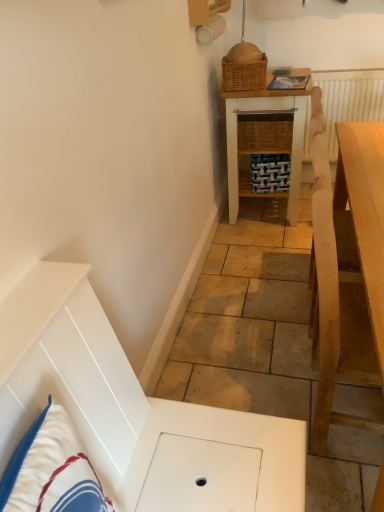
Locate an element on the screen. The height and width of the screenshot is (512, 384). white textured radiator at upper right is located at coordinates (349, 99).

At what (x,y) coordinates should I click in order to perform the action: click on light wood table at right, placed as the first table when sorted from front to back. Please return your answer as a coordinate pair (x, y). The height and width of the screenshot is (512, 384). Looking at the image, I should click on (337, 301).

Measure the distance between point (382, 156) and camera.

The distance of point (382, 156) from camera is 5.43 feet.

Where is `white cotton pillow at lower left`? This screenshot has height=512, width=384. white cotton pillow at lower left is located at coordinates (52, 470).

Is white textured radiator at upper right behind woven brown picnic basket at upper center?

Yes, white textured radiator at upper right is behind woven brown picnic basket at upper center.

Which is correct: white textured radiator at upper right is inside woven brown picnic basket at upper center, or outside of it?

white textured radiator at upper right is not enclosed by woven brown picnic basket at upper center.

Can you confirm if white textured radiator at upper right is smaller than woven brown picnic basket at upper center?

No, white textured radiator at upper right is not smaller than woven brown picnic basket at upper center.

From the picture: From a real-world perspective, is white textured radiator at upper right physically located above or below woven brown picnic basket at upper center?

white textured radiator at upper right is below woven brown picnic basket at upper center.

Is point (46, 499) closer or farther from the camera than point (268, 142)?

Point (46, 499) is positioned closer to the camera compared to point (268, 142).

Is white cotton pillow at lower left inside or outside of woven wood table at center, which is the first table in back-to-front order?

white cotton pillow at lower left exists outside the volume of woven wood table at center, which is the first table in back-to-front order.

How different are the orientations of white cotton pillow at lower left and woven wood table at center, which is counted as the second table, starting from the bottom, in degrees?

The facing directions of white cotton pillow at lower left and woven wood table at center, which is counted as the second table, starting from the bottom, are 2.14 degrees apart.

Is white cotton pillow at lower left in front of or behind woven wood table at center, the 1th table when ordered from top to bottom, in the image?

white cotton pillow at lower left is positioned closer to the viewer than woven wood table at center, the 1th table when ordered from top to bottom.

Looking at their sizes, would you say woven brown picnic basket at upper center is wider or thinner than white textured radiator at upper right?

Clearly, woven brown picnic basket at upper center has more width compared to white textured radiator at upper right.

Looking at this image, considering the positions of objects woven brown picnic basket at upper center and white textured radiator at upper right in the image provided, who is more to the right, woven brown picnic basket at upper center or white textured radiator at upper right?

white textured radiator at upper right is more to the right.

Can you confirm if woven brown picnic basket at upper center is smaller than white textured radiator at upper right?

Indeed, woven brown picnic basket at upper center has a smaller size compared to white textured radiator at upper right.

From a real-world perspective, is woven brown picnic basket at upper center physically located above or below white textured radiator at upper right?

In terms of real-world spatial position, woven brown picnic basket at upper center is above white textured radiator at upper right.

Could you tell me if woven wood table at center, which is counted as the second table, starting from the bottom, is facing woven brown picnic basket at upper center?

No, woven wood table at center, which is counted as the second table, starting from the bottom, does not turn towards woven brown picnic basket at upper center.

Looking at this image, from a real-world perspective, does woven wood table at center, which is the first table in back-to-front order, sit lower than woven brown picnic basket at upper center?

Yes.

At what (x,y) coordinates should I click in order to perform the action: click on the 1st table below the woven brown picnic basket at upper center (from the image's perspective). Please return your answer as a coordinate pair (x, y). Looking at the image, I should click on (264, 138).

From the image's perspective, which is above, woven wood table at center, the 1th table when ordered from top to bottom, or woven brown picnic basket at upper center?

woven brown picnic basket at upper center appears higher in the image.

Between white cotton pillow at lower left and white textured radiator at upper right, which one has less height?

white cotton pillow at lower left.

From a real-world perspective, is white cotton pillow at lower left over white textured radiator at upper right?

Yes.

Is white cotton pillow at lower left wider than white textured radiator at upper right?

Yes.

From the image's perspective, is woven wood table at center, the 2th table viewed from the front, under white cotton pillow at lower left?

Actually, woven wood table at center, the 2th table viewed from the front, appears above white cotton pillow at lower left in the image.

Who is taller, woven wood table at center, which is the first table in back-to-front order, or white cotton pillow at lower left?

woven wood table at center, which is the first table in back-to-front order.

From the picture: Between woven wood table at center, the 1th table when ordered from top to bottom, and white cotton pillow at lower left, which one has smaller width?

white cotton pillow at lower left is thinner.

Considering the relative sizes of woven wood table at center, the 1th table when ordered from top to bottom, and white textured radiator at upper right in the image provided, is woven wood table at center, the 1th table when ordered from top to bottom, taller than white textured radiator at upper right?

Yes, woven wood table at center, the 1th table when ordered from top to bottom, is taller than white textured radiator at upper right.

From the image's perspective, which object appears higher, woven wood table at center, which is counted as the second table, starting from the bottom, or white textured radiator at upper right?

white textured radiator at upper right.

From a real-world perspective, between woven wood table at center, which is counted as the second table, starting from the bottom, and white textured radiator at upper right, who is vertically higher?

white textured radiator at upper right.

How far apart are woven wood table at center, the 2th table viewed from the front, and white textured radiator at upper right?

The distance of woven wood table at center, the 2th table viewed from the front, from white textured radiator at upper right is 22.13 inches.

This screenshot has width=384, height=512. What are the coordinates of `picnic basket on the left of white textured radiator at upper right` in the screenshot? It's located at (244, 68).

Find the location of a particular element. the 2nd table directly beneath the white cotton pillow at lower left (from a real-world perspective) is located at coordinates (264, 138).

Which object lies nearer to the anchor point white cotton pillow at lower left, light wood table at right, placed as the first table when sorted from front to back, or white textured radiator at upper right?

light wood table at right, placed as the first table when sorted from front to back, lies closer to white cotton pillow at lower left than the other object.

Looking at the image, which one is located further to woven brown picnic basket at upper center, white textured radiator at upper right or light wood table at right, placed as the first table when sorted from front to back?

Based on the image, light wood table at right, placed as the first table when sorted from front to back, appears to be further to woven brown picnic basket at upper center.

Estimate the real-world distances between objects in this image. Which object is further from white textured radiator at upper right, woven brown picnic basket at upper center or white cotton pillow at lower left?

white cotton pillow at lower left is positioned further to the anchor white textured radiator at upper right.

Looking at the image, which one is located closer to woven brown picnic basket at upper center, white textured radiator at upper right or white cotton pillow at lower left?

white textured radiator at upper right is closer to woven brown picnic basket at upper center.

Based on their spatial positions, is woven brown picnic basket at upper center or white cotton pillow at lower left closer to light wood table at right, placed as the first table when sorted from front to back?

Based on the image, white cotton pillow at lower left appears to be nearer to light wood table at right, placed as the first table when sorted from front to back.

From the image, which object appears to be nearer to white cotton pillow at lower left, woven wood table at center, which is counted as the second table, starting from the bottom, or white textured radiator at upper right?

woven wood table at center, which is counted as the second table, starting from the bottom.

Considering their positions, is woven wood table at center, which is the first table in back-to-front order, positioned closer to light wood table at right, the second table positioned from the back, than white textured radiator at upper right?

woven wood table at center, which is the first table in back-to-front order.

Which object lies further to the anchor point light wood table at right, the second table positioned from the back, white cotton pillow at lower left or white textured radiator at upper right?

The object further to light wood table at right, the second table positioned from the back, is white textured radiator at upper right.

You are a GUI agent. You are given a task and a screenshot of the screen. Output one action in this format:
    pyautogui.click(x=<x>, y=<y>)
    Task: Click on the table between white cotton pillow at lower left and woven wood table at center, which is counted as the second table, starting from the bottom, from front to back
    
    Given the screenshot: What is the action you would take?
    pyautogui.click(x=337, y=301)

Image resolution: width=384 pixels, height=512 pixels. I want to click on table positioned between light wood table at right, which is counted as the 2th table, starting from the top, and white textured radiator at upper right from near to far, so click(x=264, y=138).

Identify the location of picnic basket positioned between white cotton pillow at lower left and woven wood table at center, the 1th table when ordered from top to bottom, from near to far. (244, 68).

Find the location of a particular element. This screenshot has height=512, width=384. picnic basket positioned between light wood table at right, which appears as the 1th table when ordered from the bottom, and white textured radiator at upper right from near to far is located at coordinates (244, 68).